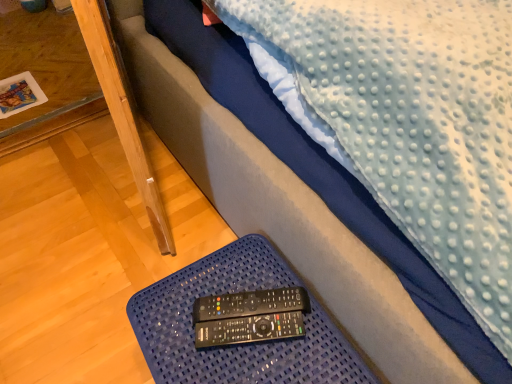
Question: From a real-world perspective, does wooden table at lower left stand above black plastic remote at lower center, which ranks as the 1th control in back-to-front order?

Choices:
 (A) yes
 (B) no

Answer: (B)

Question: From a real-world perspective, is wooden table at lower left under black plastic remote at lower center, which is counted as the second control, starting from the front?

Choices:
 (A) no
 (B) yes

Answer: (B)

Question: Could black plastic remote at lower center, which ranks as the 1th control in back-to-front order, be considered to be inside wooden table at lower left?

Choices:
 (A) no
 (B) yes

Answer: (A)

Question: Considering the relative sizes of wooden table at lower left and black plastic remote at lower center, which is counted as the second control, starting from the front, in the image provided, is wooden table at lower left thinner than black plastic remote at lower center, which is counted as the second control, starting from the front,?

Choices:
 (A) yes
 (B) no

Answer: (B)

Question: Considering the relative sizes of wooden table at lower left and black plastic remote at lower center, which ranks as the 1th control in back-to-front order, in the image provided, is wooden table at lower left shorter than black plastic remote at lower center, which ranks as the 1th control in back-to-front order,?

Choices:
 (A) no
 (B) yes

Answer: (A)

Question: From the image's perspective, is wooden table at lower left under black plastic remote at lower center, which ranks as the 1th control in back-to-front order?

Choices:
 (A) yes
 (B) no

Answer: (B)

Question: Is blue textured tray at lower center outside of black plastic remote at lower center, which ranks as the 1th control in back-to-front order?

Choices:
 (A) yes
 (B) no

Answer: (A)

Question: Can you confirm if blue textured tray at lower center is bigger than black plastic remote at lower center, which ranks as the 1th control in back-to-front order?

Choices:
 (A) no
 (B) yes

Answer: (B)

Question: Considering the relative sizes of blue textured tray at lower center and black plastic remote at lower center, which is counted as the second control, starting from the front, in the image provided, is blue textured tray at lower center taller than black plastic remote at lower center, which is counted as the second control, starting from the front,?

Choices:
 (A) yes
 (B) no

Answer: (A)

Question: Is black plastic remote at lower center, which is counted as the second control, starting from the front, surrounded by blue textured tray at lower center?

Choices:
 (A) yes
 (B) no

Answer: (B)

Question: Is blue textured tray at lower center turned away from black plastic remote at lower center, which ranks as the 1th control in back-to-front order?

Choices:
 (A) yes
 (B) no

Answer: (B)

Question: From the image's perspective, is blue textured tray at lower center located above black plastic remote at lower center, which is counted as the second control, starting from the front?

Choices:
 (A) yes
 (B) no

Answer: (B)

Question: Considering the relative positions of black plastic remote at lower center, the 1th control viewed from the front, and blue textured tray at lower center in the image provided, is black plastic remote at lower center, the 1th control viewed from the front, to the left of blue textured tray at lower center from the viewer's perspective?

Choices:
 (A) no
 (B) yes

Answer: (A)